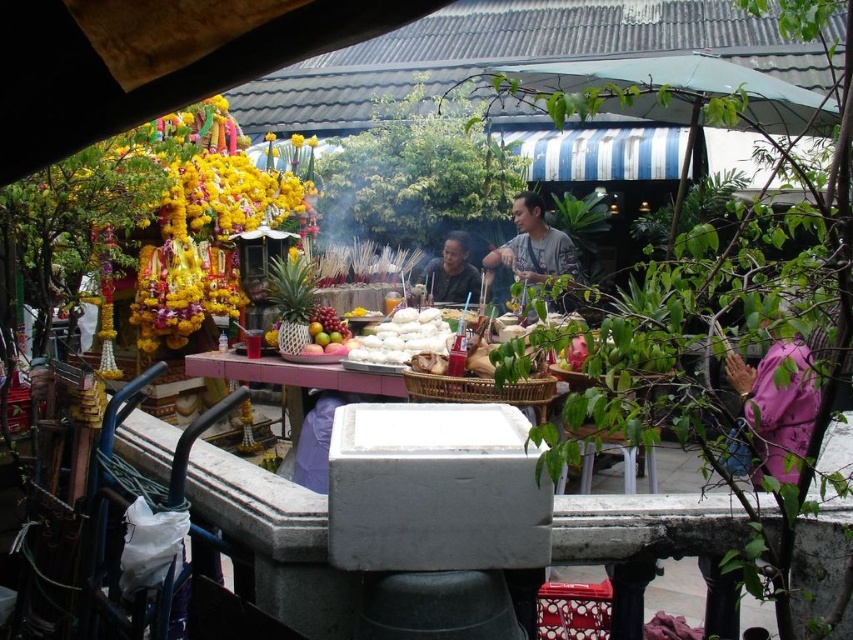
Is gray cotton shirt at center thinner than white fluffy dumplings at center?

In fact, gray cotton shirt at center might be wider than white fluffy dumplings at center.

Does gray cotton shirt at center have a greater width compared to white fluffy dumplings at center?

Yes.

Find the location of `gray cotton shirt at center`. gray cotton shirt at center is located at coordinates (532, 244).

You are a GUI agent. You are given a task and a screenshot of the screen. Output one action in this format:
    pyautogui.click(x=<x>, y=<y>)
    Task: Click on the gray cotton shirt at center
    This screenshot has height=640, width=853.
    Given the screenshot: What is the action you would take?
    pyautogui.click(x=532, y=244)

Which is behind, point (439, 317) or point (457, 268)?

Positioned behind is point (457, 268).

At what (x,y) coordinates should I click in order to perform the action: click on white fluffy dumplings at center. Please return your answer as a coordinate pair (x, y). The width and height of the screenshot is (853, 640). Looking at the image, I should click on (402, 339).

At what (x,y) coordinates should I click in order to perform the action: click on white fluffy dumplings at center. Please return your answer as a coordinate pair (x, y). The width and height of the screenshot is (853, 640). Looking at the image, I should click on (402, 339).

Is point (811, 412) closer to camera compared to point (456, 243)?

Yes, point (811, 412) is closer to viewer.

The image size is (853, 640). What do you see at coordinates (776, 403) in the screenshot? I see `pink fabric at right` at bounding box center [776, 403].

Locate an element on the screen. Image resolution: width=853 pixels, height=640 pixels. pink fabric at right is located at coordinates point(776,403).